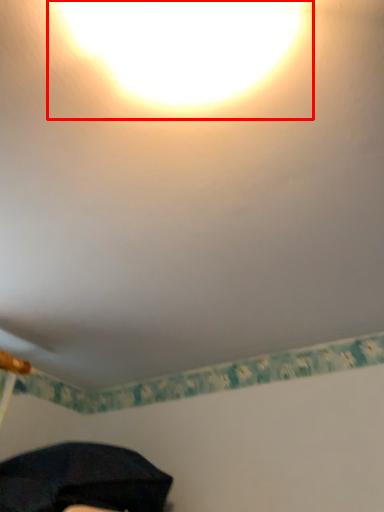
Question: From the image's perspective, where is light (annotated by the red box) located relative to umbrella?

Choices:
 (A) below
 (B) above

Answer: (B)